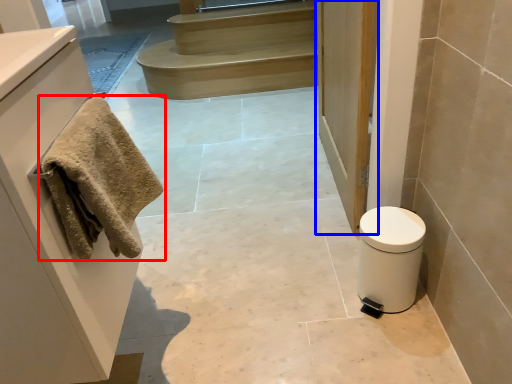
Question: Which of the following is the closest to the observer, towel (highlighted by a red box) or door (highlighted by a blue box)?

Choices:
 (A) towel
 (B) door

Answer: (A)